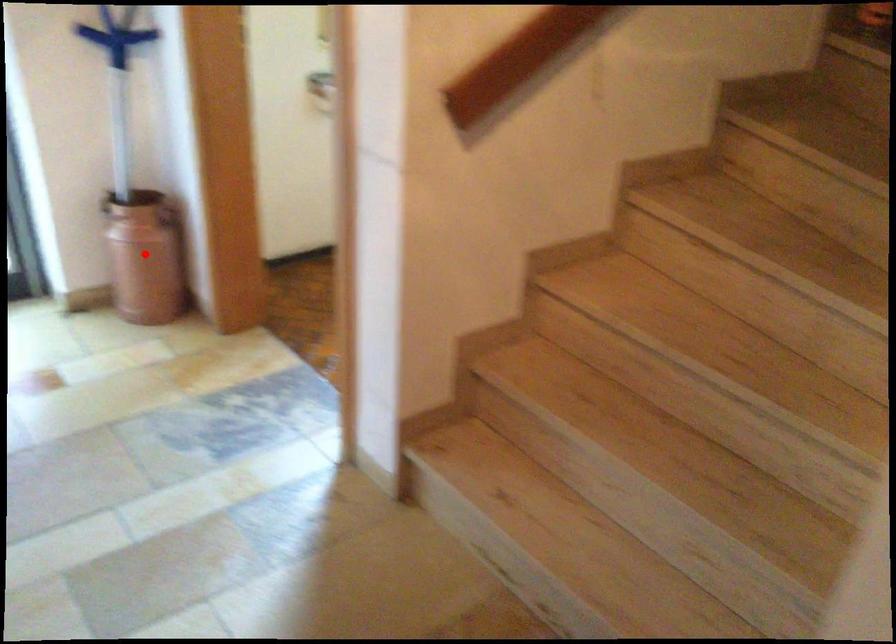
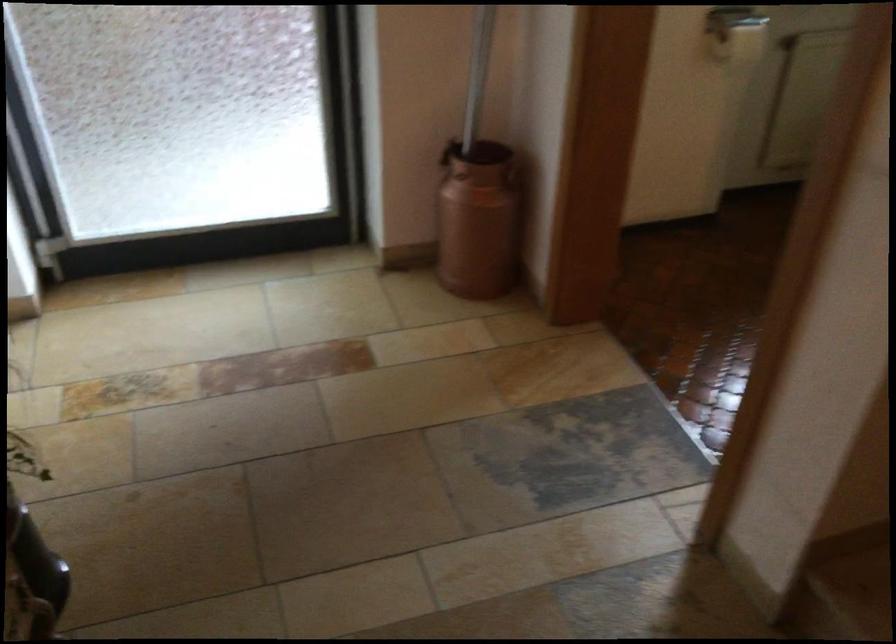
Question: I am providing you with two images of the same scene from different viewpoints. A red point is shown in image1. For the corresponding object point in image2, is it positioned nearer or farther from the camera?

Choices:
 (A) Nearer
 (B) Farther

Answer: (A)